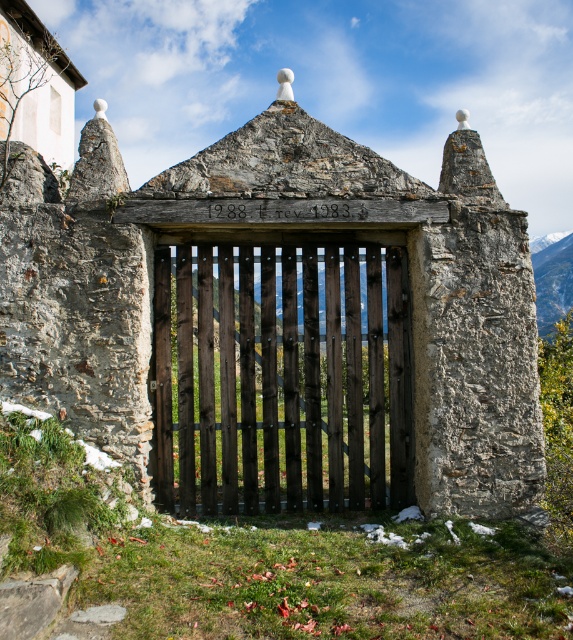
Which is more to the right, dark wood gate at center or smooth gray rock at upper right?

smooth gray rock at upper right is more to the right.

Which of these two, dark wood gate at center or smooth gray rock at upper right, stands taller?

smooth gray rock at upper right is taller.

Who is more forward, (x=288, y=369) or (x=543, y=321)?

Point (x=288, y=369) is more forward.

The height and width of the screenshot is (640, 573). What are the coordinates of `dark wood gate at center` in the screenshot? It's located at 282,378.